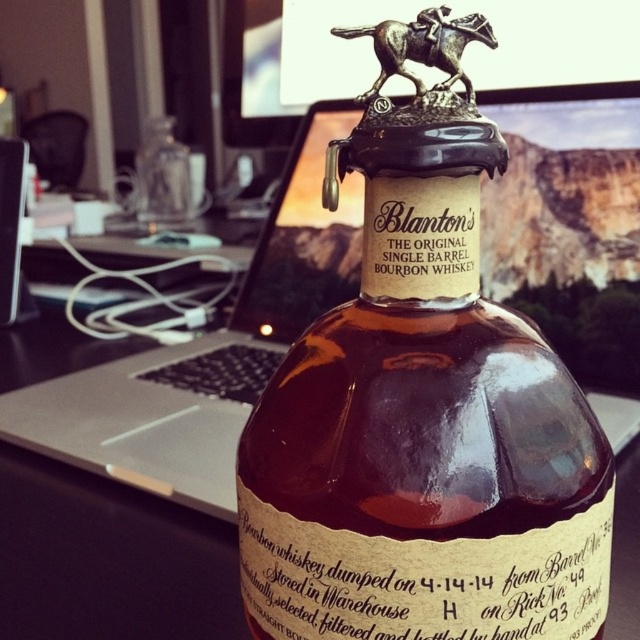
Is silver metallic laptop at center to the left of bronze/textured horse at top from the viewer's perspective?

Indeed, silver metallic laptop at center is positioned on the left side of bronze/textured horse at top.

Does point (152, 387) lie behind point (385, 54)?

Yes, it is behind point (385, 54).

Is point (214, 387) less distant than point (429, 44)?

No.

Where is `silver metallic laptop at center`? The height and width of the screenshot is (640, 640). silver metallic laptop at center is located at coordinates [209, 349].

Between point (413, 13) and point (138, 208), which one is positioned in front?

Point (413, 13) is in front.

Is point (428, 68) behind point (148, 188)?

No, (428, 68) is in front of (148, 188).

Find the location of a particular element. metallic horse trophy at upper center is located at coordinates (408, 19).

Is point (412, 472) less distant than point (307, 0)?

Yes.

How distant is brown glass bottle at center from metallic horse trophy at upper center?

A distance of 3.51 feet exists between brown glass bottle at center and metallic horse trophy at upper center.

Does point (436, 426) come closer to viewer compared to point (273, 77)?

Yes, it is.

Find the location of a particular element. brown glass bottle at center is located at coordinates (422, 426).